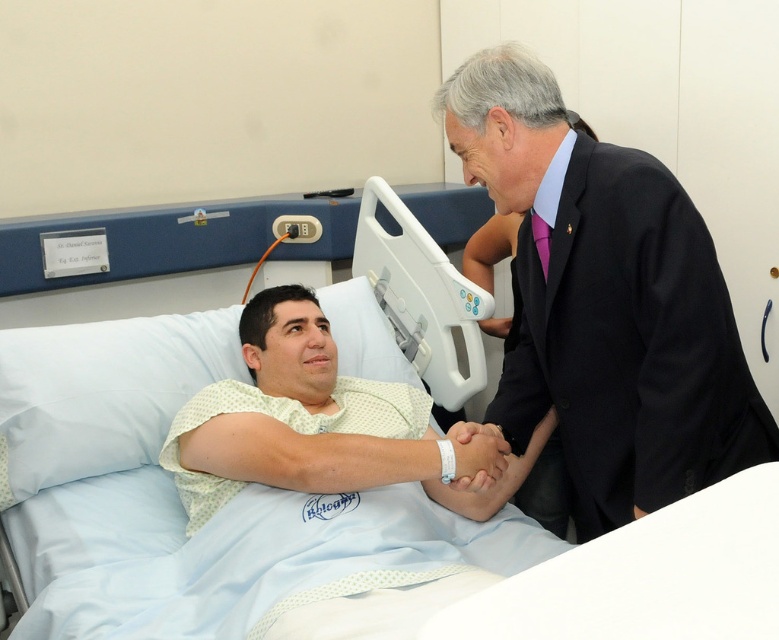
Between light blue fabric hospital bed at center and black satin business suit at right, which one is positioned lower?

Positioned lower is light blue fabric hospital bed at center.

Can you confirm if light blue fabric hospital bed at center is positioned above black satin business suit at right?

Actually, light blue fabric hospital bed at center is below black satin business suit at right.

Identify the location of light blue fabric hospital bed at center. The width and height of the screenshot is (779, 640). tap(120, 477).

The width and height of the screenshot is (779, 640). I want to click on light blue fabric hospital bed at center, so click(120, 477).